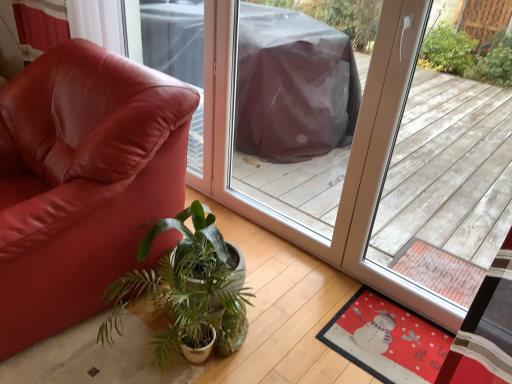
Find the location of `spots to the right of green leafy plant at center`. spots to the right of green leafy plant at center is located at coordinates click(288, 341).